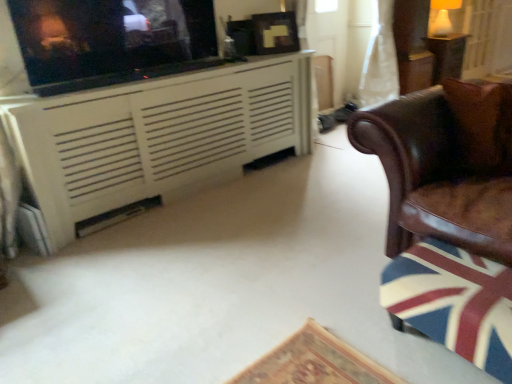
Where is `vacant area that lies between brown leather chair at right and white painted wood cabinet at upper left`? This screenshot has width=512, height=384. vacant area that lies between brown leather chair at right and white painted wood cabinet at upper left is located at coordinates pyautogui.click(x=250, y=231).